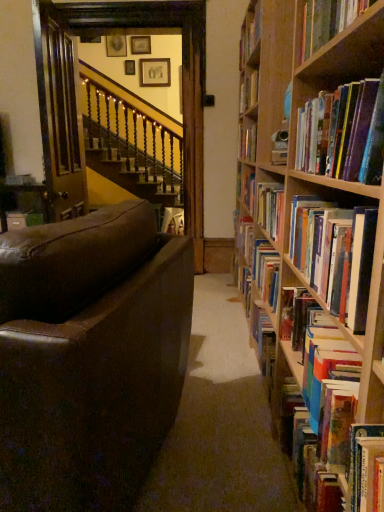
Where is `hardcover book at right, which ranks as the fourth book in front-to-back order`? Image resolution: width=384 pixels, height=512 pixels. hardcover book at right, which ranks as the fourth book in front-to-back order is located at coordinates (327, 416).

The height and width of the screenshot is (512, 384). What do you see at coordinates (343, 133) in the screenshot?
I see `hardcover books at upper right, which is counted as the 1th book, starting from the front` at bounding box center [343, 133].

The image size is (384, 512). What do you see at coordinates (116, 46) in the screenshot?
I see `wooden picture frame at upper center, the first picture frame in the left-to-right sequence` at bounding box center [116, 46].

Where is `hardcover book at right, which ranks as the fourth book in front-to-back order`? The height and width of the screenshot is (512, 384). hardcover book at right, which ranks as the fourth book in front-to-back order is located at coordinates (327, 416).

Which of these two, hardcover book at right, which ranks as the fourth book in front-to-back order, or wooden picture frame at upper center, the 3th picture frame viewed from the left, stands shorter?

With less height is hardcover book at right, which ranks as the fourth book in front-to-back order.

In terms of width, does hardcover book at right, which ranks as the fourth book in front-to-back order, look wider or thinner when compared to wooden picture frame at upper center, the 3th picture frame viewed from the left?

Considering their sizes, hardcover book at right, which ranks as the fourth book in front-to-back order, looks broader than wooden picture frame at upper center, the 3th picture frame viewed from the left.

From the image's perspective, which is above, hardcover book at right, which ranks as the fourth book in front-to-back order, or wooden picture frame at upper center, the 1th picture frame from the right?

wooden picture frame at upper center, the 1th picture frame from the right, appears higher in the image.

How different are the orientations of hardcover book at right, placed as the 3th book when sorted from back to front, and wooden picture frame at upper center, the 3th picture frame viewed from the left, in degrees?

89 degrees.

From the image's perspective, which object appears higher, wooden picture frame at upper center, the 3th picture frame viewed from the left, or hardcover book at right, placed as the 3th book when sorted from back to front?

wooden picture frame at upper center, the 3th picture frame viewed from the left.

Who is smaller, wooden picture frame at upper center, the 3th picture frame viewed from the left, or hardcover book at right, which ranks as the fourth book in front-to-back order?

wooden picture frame at upper center, the 3th picture frame viewed from the left, is smaller.

Identify the location of the 1st picture frame above the hardcover book at right, placed as the 3th book when sorted from back to front (from a real-world perspective). This screenshot has width=384, height=512. (155, 72).

Considering the sizes of objects wooden picture frame at upper center, the first picture frame in the left-to-right sequence, and hardcover books at right, which ranks as the 4th book in back-to-front order, in the image provided, who is bigger, wooden picture frame at upper center, the first picture frame in the left-to-right sequence, or hardcover books at right, which ranks as the 4th book in back-to-front order,?

With larger size is hardcover books at right, which ranks as the 4th book in back-to-front order.

Which picture frame is the 3rd one when counting from the left side of the hardcover books at right, which ranks as the 4th book in back-to-front order? Please provide its 2D coordinates.

[(116, 46)]

From a real-world perspective, who is located higher, wooden picture frame at upper center, the first picture frame in the left-to-right sequence, or hardcover books at right, the third book positioned from the front?

In real-world perspective, wooden picture frame at upper center, the first picture frame in the left-to-right sequence, is above.

Does wooden picture frame at upper center, the 3th picture frame from the right, have a greater height compared to hardcover books at right, which ranks as the 4th book in back-to-front order?

Yes, wooden picture frame at upper center, the 3th picture frame from the right, is taller than hardcover books at right, which ranks as the 4th book in back-to-front order.

In the image, is wooden picture frame at upper center, the 3th picture frame viewed from the left, positioned in front of or behind hardcover books at upper right, the sixth book from the back?

Visually, wooden picture frame at upper center, the 3th picture frame viewed from the left, is located behind hardcover books at upper right, the sixth book from the back.

From a real-world perspective, relative to hardcover books at upper right, the sixth book from the back, is wooden picture frame at upper center, the 1th picture frame from the right, vertically above or below?

wooden picture frame at upper center, the 1th picture frame from the right, is situated higher than hardcover books at upper right, the sixth book from the back, in the real world.

Is wooden picture frame at upper center, the 3th picture frame viewed from the left, outside of hardcover books at upper right, the sixth book from the back?

Yes, wooden picture frame at upper center, the 3th picture frame viewed from the left, is outside of hardcover books at upper right, the sixth book from the back.

Looking at this image, can you see wooden picture frame at upper center, the 1th picture frame from the right, touching hardcover books at upper right, which is counted as the 1th book, starting from the front?

No, wooden picture frame at upper center, the 1th picture frame from the right, is not making contact with hardcover books at upper right, which is counted as the 1th book, starting from the front.

The height and width of the screenshot is (512, 384). There is a wooden picture frame at upper center, which ranks as the second picture frame in left-to-right order. In order to click on the 5th book below it (from the image's perspective) in this screenshot , I will do `click(335, 255)`.

Is point (306, 200) farther from viewer compared to point (146, 38)?

No, (306, 200) is in front of (146, 38).

Is hardcover books at right, which ranks as the 4th book in back-to-front order, oriented away from wooden picture frame at upper center, which appears as the 2th picture frame when viewed from the right?

No, hardcover books at right, which ranks as the 4th book in back-to-front order, is not facing away from wooden picture frame at upper center, which appears as the 2th picture frame when viewed from the right.

Is hardcover books at right, which ranks as the 4th book in back-to-front order, bigger or smaller than wooden picture frame at upper center, which ranks as the second picture frame in left-to-right order?

Considering their sizes, hardcover books at right, which ranks as the 4th book in back-to-front order, takes up more space than wooden picture frame at upper center, which ranks as the second picture frame in left-to-right order.

Considering the sizes of hardcover books at right, the third book positioned from the front, and hardcover book at right, which ranks as the fourth book in front-to-back order, in the image, is hardcover books at right, the third book positioned from the front, wider or thinner than hardcover book at right, which ranks as the fourth book in front-to-back order,?

hardcover books at right, the third book positioned from the front, is thinner than hardcover book at right, which ranks as the fourth book in front-to-back order.

Can you tell me how much hardcover books at right, the third book positioned from the front, and hardcover book at right, which ranks as the fourth book in front-to-back order, differ in facing direction?

The facing directions of hardcover books at right, the third book positioned from the front, and hardcover book at right, which ranks as the fourth book in front-to-back order, are 0.00126 degrees apart.

Which object is positioned more to the right, hardcover books at right, the third book positioned from the front, or hardcover book at right, placed as the 3th book when sorted from back to front?

Positioned to the right is hardcover books at right, the third book positioned from the front.

Does point (344, 28) come closer to viewer compared to point (297, 452)?

Yes, it is in front of point (297, 452).

From the image's perspective, which one is positioned higher, hardcover book at upper right, the 5th book when ordered from back to front, or hardcover book at right, which ranks as the fourth book in front-to-back order?

hardcover book at upper right, the 5th book when ordered from back to front, is shown above in the image.

Is hardcover book at right, which ranks as the fourth book in front-to-back order, at the back of hardcover book at upper right, the 5th book when ordered from back to front?

No, hardcover book at upper right, the 5th book when ordered from back to front, is not facing the opposite direction of hardcover book at right, which ranks as the fourth book in front-to-back order.

Between hardcover book at upper right, the 5th book when ordered from back to front, and hardcover book at right, which ranks as the fourth book in front-to-back order, which one has more height?

hardcover book at right, which ranks as the fourth book in front-to-back order, is taller.

This screenshot has width=384, height=512. What are the coordinates of `the 2nd book to the right when counting from the wooden picture frame at upper center, the 1th picture frame from the right` in the screenshot? It's located at (327, 416).

Which picture frame is the 1st one when counting from the left side of the hardcover book at right, which ranks as the fourth book in front-to-back order? Please provide its 2D coordinates.

[(155, 72)]

Based on their spatial positions, is matte white book at center or wooden picture frame at upper center, the 1th picture frame from the right, further from hardcover book at center, the first book in the back-to-front sequence?

wooden picture frame at upper center, the 1th picture frame from the right, is further to hardcover book at center, the first book in the back-to-front sequence.

From the image, which object appears to be farther from hardcover book at upper right, the 5th book when ordered from back to front, wooden picture frame at upper center, the first picture frame in the left-to-right sequence, or hardcover books at right, the third book positioned from the front?

Based on the image, wooden picture frame at upper center, the first picture frame in the left-to-right sequence, appears to be further to hardcover book at upper right, the 5th book when ordered from back to front.

Looking at the image, which one is located closer to hardcover book at upper right, the 5th book when ordered from back to front, hardcover book at right, placed as the 3th book when sorted from back to front, or hardcover books at right, which ranks as the 4th book in back-to-front order?

Among the two, hardcover books at right, which ranks as the 4th book in back-to-front order, is located nearer to hardcover book at upper right, the 5th book when ordered from back to front.

Which object lies further to the anchor point matte white book at center, hardcover books at upper right, which is counted as the 1th book, starting from the front, or wooden picture frame at upper center, the first picture frame in the left-to-right sequence?

wooden picture frame at upper center, the first picture frame in the left-to-right sequence, is positioned further to the anchor matte white book at center.

Estimate the real-world distances between objects in this image. Which object is further from brown leather couch at left, hardcover book at right, which ranks as the fourth book in front-to-back order, or hardcover books at upper right, the sixth book from the back?

hardcover books at upper right, the sixth book from the back, is positioned further to the anchor brown leather couch at left.

When comparing their distances from matte white book at center, does wooden picture frame at upper center, the first picture frame in the left-to-right sequence, or hardcover book at right, which ranks as the fourth book in front-to-back order, seem closer?

The object closer to matte white book at center is hardcover book at right, which ranks as the fourth book in front-to-back order.

Considering their positions, is wooden picture frame at upper center, the 1th picture frame from the right, positioned further to brown leather couch at left than wooden picture frame at upper center, which appears as the 2th picture frame when viewed from the right?

wooden picture frame at upper center, which appears as the 2th picture frame when viewed from the right, is further to brown leather couch at left.

Considering their positions, is hardcover book at center, marked as the fifth book in a front-to-back arrangement, positioned closer to hardcover book at right, placed as the 3th book when sorted from back to front, than wooden picture frame at upper center, the first picture frame in the left-to-right sequence?

hardcover book at center, marked as the fifth book in a front-to-back arrangement.

Locate an element on the screen. paperback book between hardcover book at center, marked as the fifth book in a front-to-back arrangement, and wooden picture frame at upper center, which appears as the 2th picture frame when viewed from the right, in the front-back direction is located at coordinates (173, 221).

The image size is (384, 512). I want to click on paperback book between brown leather couch at left and wooden picture frame at upper center, the 1th picture frame from the right, in the front-back direction, so tap(173, 221).

The width and height of the screenshot is (384, 512). In order to click on picture frame between hardcover books at upper right, the sixth book from the back, and wooden picture frame at upper center, which appears as the 2th picture frame when viewed from the right, along the z-axis in this screenshot , I will do `click(116, 46)`.

In order to click on picture frame located between hardcover book at center, the first book in the back-to-front sequence, and wooden picture frame at upper center, which ranks as the second picture frame in left-to-right order, in the depth direction in this screenshot , I will do `click(116, 46)`.